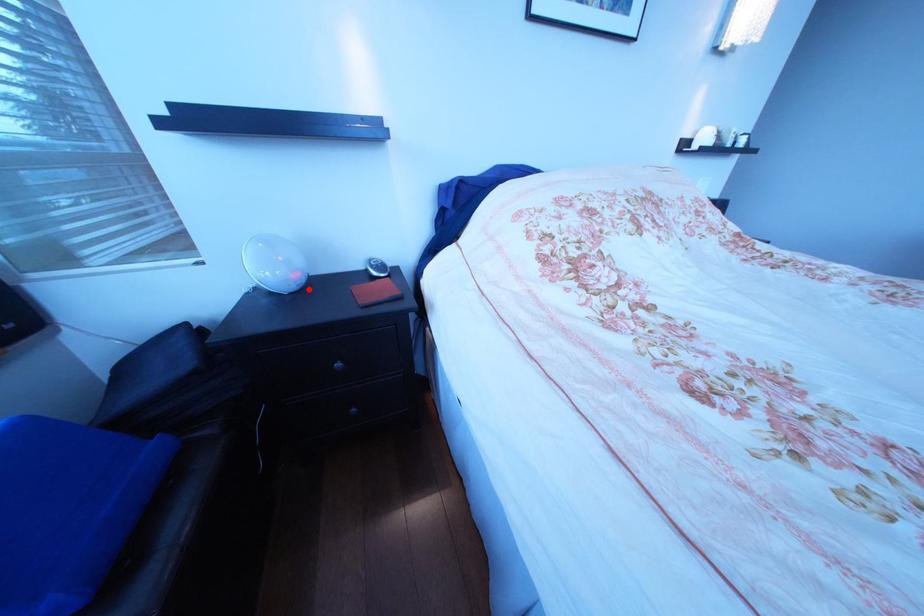
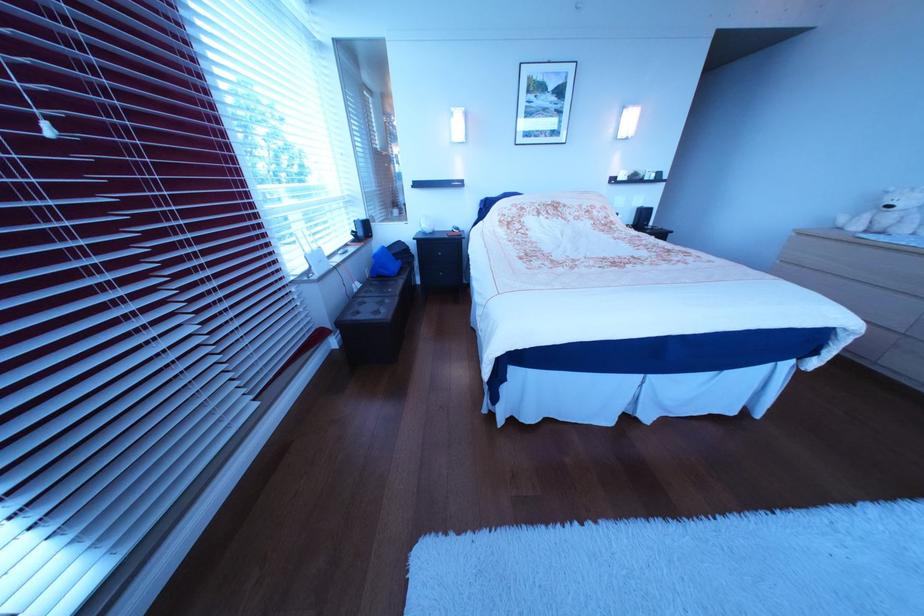
Question: A red point is marked in image1. In image2, is the corresponding 3D point closer to the camera or farther? Reply with the corresponding letter.

Choices:
 (A) The corresponding 3D point is closer.
 (B) The corresponding 3D point is farther.

Answer: (A)